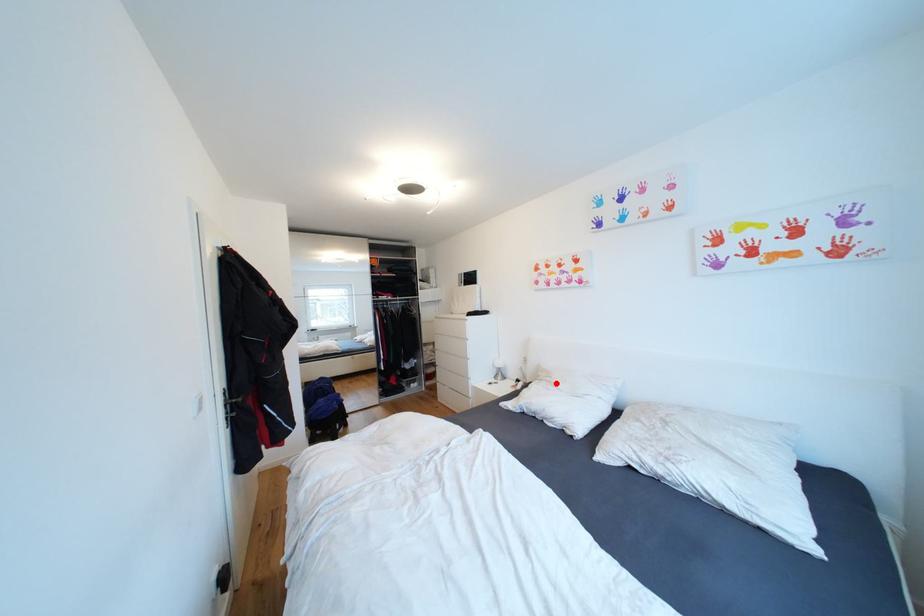
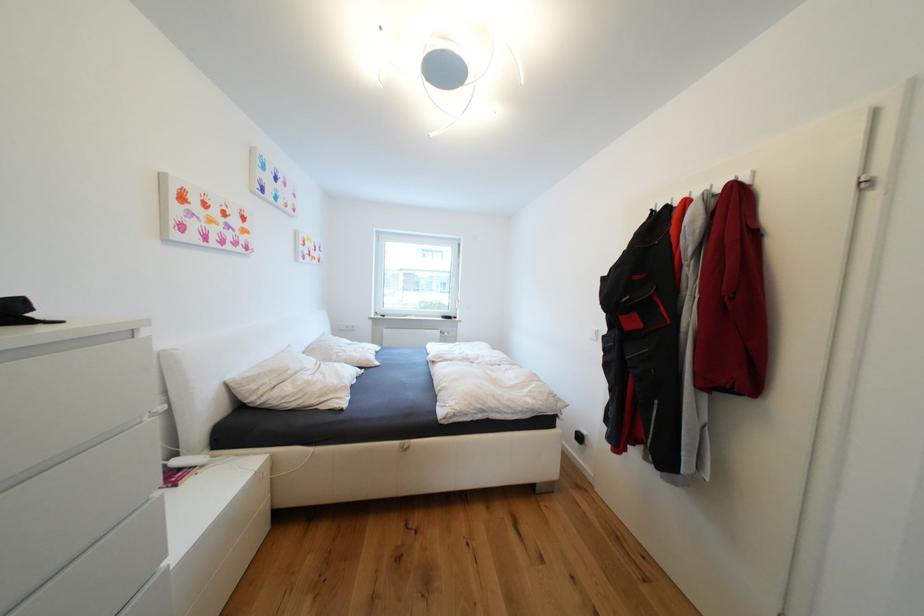
Question: I am providing you with two images of the same scene from different viewpoints. Image1 has a red point marked. In image2, the corresponding 3D location appears at what relative position? Reply with the corresponding letter.

Choices:
 (A) Closer
 (B) Farther

Answer: (A)